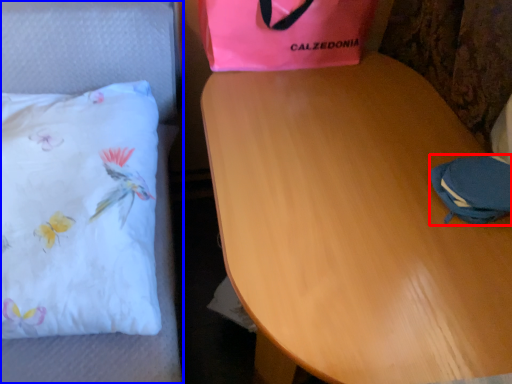
Question: Which point is further to the camera, pouch (highlighted by a red box) or furniture (highlighted by a blue box)?

Choices:
 (A) pouch
 (B) furniture

Answer: (A)